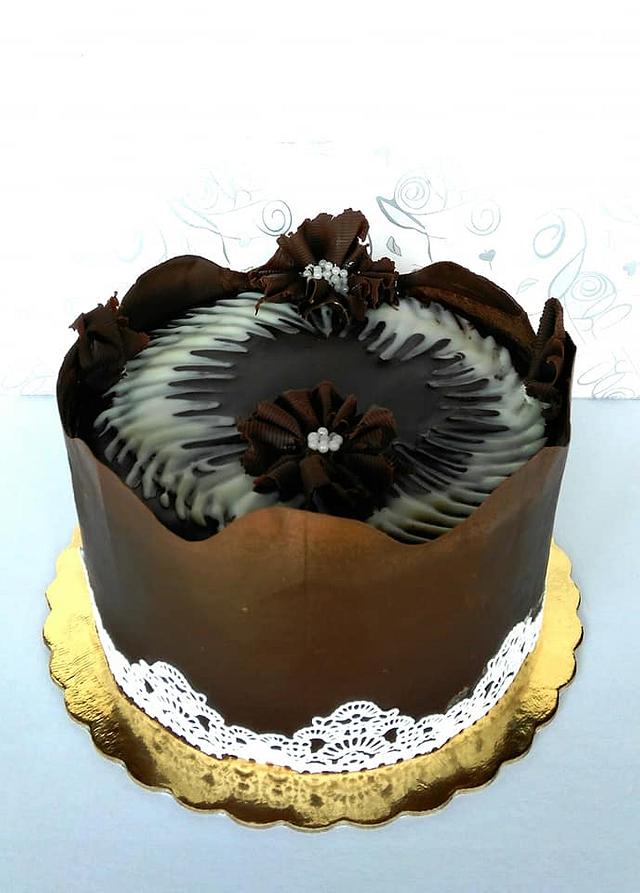
The height and width of the screenshot is (893, 640). What are the coordinates of `paper holder` in the screenshot? It's located at (369, 624).